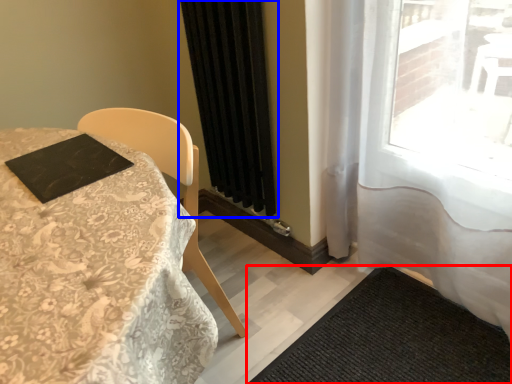
Question: Which object appears farthest to the camera in this image, doormat (highlighted by a red box) or curtain (highlighted by a blue box)?

Choices:
 (A) doormat
 (B) curtain

Answer: (B)